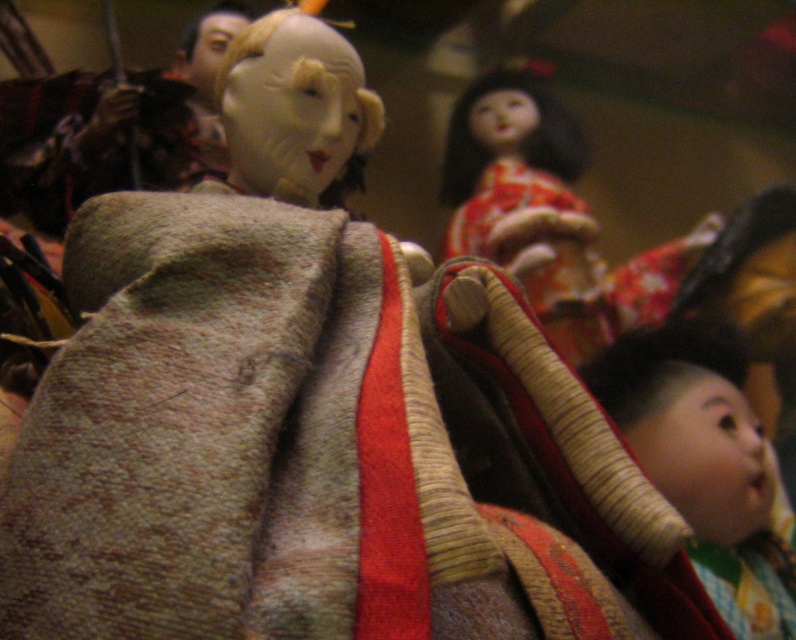
Question: Is smooth beige headband at lower right behind matte orange kimono at upper center?

Choices:
 (A) no
 (B) yes

Answer: (A)

Question: Which of the following is the farthest from the observer?

Choices:
 (A) matte orange kimono at upper center
 (B) smooth beige headband at lower right

Answer: (A)

Question: In this image, where is smooth beige headband at lower right located relative to matte orange kimono at upper center?

Choices:
 (A) below
 (B) above

Answer: (A)

Question: Which object is farther from the camera taking this photo?

Choices:
 (A) smooth beige headband at lower right
 (B) matte orange kimono at upper center

Answer: (B)

Question: Can you confirm if smooth beige headband at lower right is thinner than matte orange kimono at upper center?

Choices:
 (A) yes
 (B) no

Answer: (A)